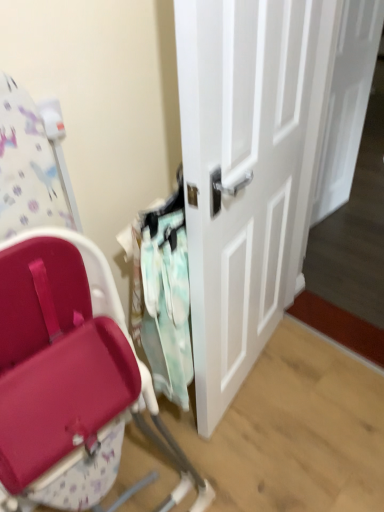
Question: Is white glossy door at center, the second door positioned from the front, in front of or behind mint fabric laundry at center in the image?

Choices:
 (A) front
 (B) behind

Answer: (B)

Question: Would you say white glossy door at center, arranged as the 2th door when viewed from the left, is to the left or to the right of mint fabric laundry at center in the picture?

Choices:
 (A) left
 (B) right

Answer: (B)

Question: Which of these objects is positioned farthest from the white glossy door at center, which is the first door from left to right?

Choices:
 (A) mint fabric laundry at center
 (B) white glossy door at center, arranged as the 1th door when viewed from the back

Answer: (B)

Question: Estimate the real-world distances between objects in this image. Which object is closer to the white glossy door at center, arranged as the 1th door when viewed from the back?

Choices:
 (A) white glossy door at center, which ranks as the second door in right-to-left order
 (B) mint fabric laundry at center

Answer: (A)